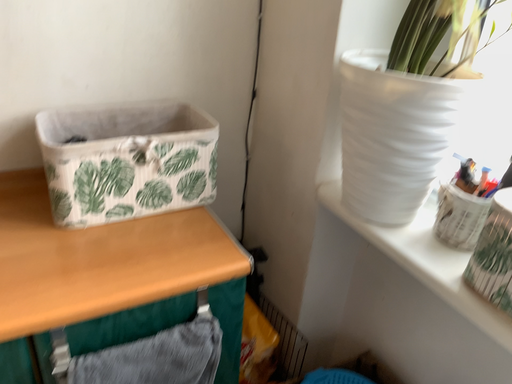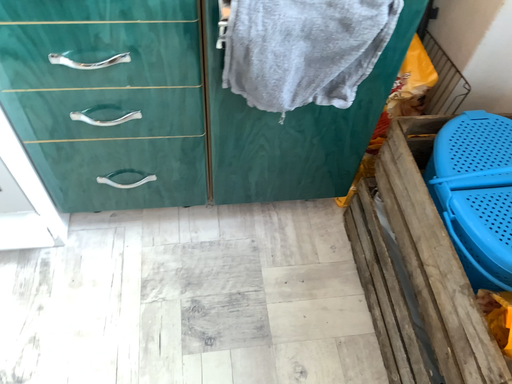
Question: How did the camera likely rotate when shooting the video?

Choices:
 (A) rotated right
 (B) rotated left

Answer: (B)